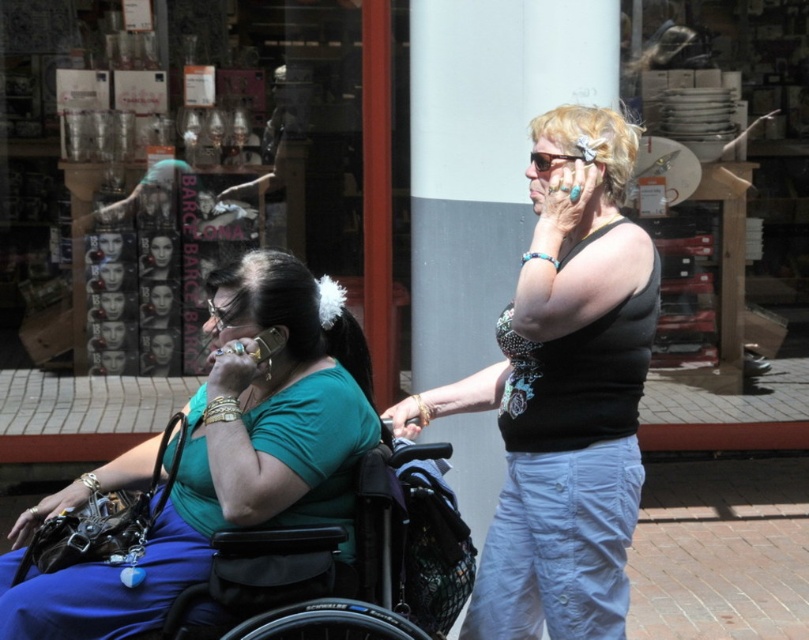
You are a photographer trying to capture a candid shot of the person wearing the black dotted tank top at center. Given that you can only focus on the exact point at coordinates point (562,392), will your camera focus on the correct subject?

Yes, the black dotted tank top at center is located at point (562,392), so focusing there will capture the correct subject.

Looking at this image, you are a delivery person who needs to place a package between the green matte shirt at center and the transparent glass display at center. The package requires 10 feet of space. Is there enough space between them?

The green matte shirt at center and transparent glass display at center are 11.11 feet apart from each other, so yes, there is enough space to place the package between them since 11.11 feet is more than the required 10 feet.